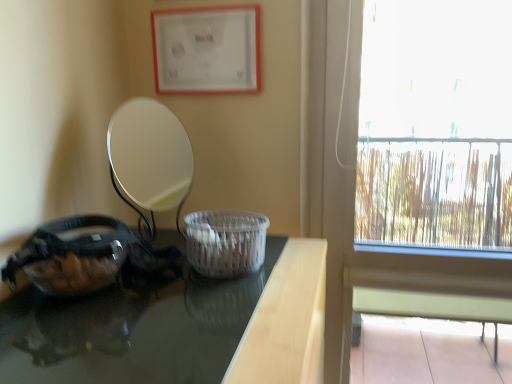
I want to click on transparent glass bowl at left, so click(72, 256).

You are a GUI agent. You are given a task and a screenshot of the screen. Output one action in this format:
    pyautogui.click(x=<x>, y=<y>)
    Task: Click on the white woven basket at center
    This screenshot has width=512, height=384.
    Given the screenshot: What is the action you would take?
    pyautogui.click(x=225, y=242)

Describe the element at coordinates (177, 328) in the screenshot. The height and width of the screenshot is (384, 512). I see `black glossy table at left` at that location.

Image resolution: width=512 pixels, height=384 pixels. Describe the element at coordinates (207, 50) in the screenshot. I see `matte white picture frame at upper center` at that location.

Find the location of a particular element. The height and width of the screenshot is (384, 512). matte white picture frame at upper center is located at coordinates (207, 50).

At what (x,y) coordinates should I click in order to perform the action: click on transparent glass bowl at left. Please return your answer as a coordinate pair (x, y). The height and width of the screenshot is (384, 512). Looking at the image, I should click on (72, 256).

Is transparent glass bowl at left in contact with black glossy table at left?

No, transparent glass bowl at left is not beside black glossy table at left.

Is point (36, 275) positioned after point (81, 334)?

Yes.

Is black glossy table at left a part of transparent glass bowl at left?

That's incorrect, black glossy table at left is not inside transparent glass bowl at left.

Considering the relative positions of transparent glass bowl at left and black glossy table at left in the image provided, is transparent glass bowl at left in front of black glossy table at left?

No, transparent glass bowl at left is further to the viewer.

Is white woven basket at center positioned with its back to transparent glass window at right?

No, white woven basket at center is not facing the opposite direction of transparent glass window at right.

From the picture: How many degrees apart are the facing directions of white woven basket at center and transparent glass window at right?

They differ by 93 degrees in their facing directions.

Looking at this image, is white woven basket at center at the right side of transparent glass window at right?

No.

Is white woven basket at center far away from transparent glass window at right?

Yes, white woven basket at center is far from transparent glass window at right.

Is matte white picture frame at upper center located within white woven basket at center?

That's incorrect, matte white picture frame at upper center is not inside white woven basket at center.

Is the surface of white woven basket at center in direct contact with matte white picture frame at upper center?

white woven basket at center is not next to matte white picture frame at upper center, and they're not touching.

Considering the sizes of white woven basket at center and matte white picture frame at upper center in the image, is white woven basket at center bigger or smaller than matte white picture frame at upper center?

Clearly, white woven basket at center is larger in size than matte white picture frame at upper center.

Is black glossy table at left closer to camera compared to transparent glass window at right?

Yes, it is in front of transparent glass window at right.

Is black glossy table at left oriented towards transparent glass window at right?

No, black glossy table at left is not turned towards transparent glass window at right.

Based on the photo, between black glossy table at left and transparent glass window at right, which one has larger width?

With larger width is black glossy table at left.

Who is smaller, transparent glass bowl at left or white woven basket at center?

Smaller between the two is white woven basket at center.

From the image's perspective, is transparent glass bowl at left located above or below white woven basket at center?

Based on their image positions, transparent glass bowl at left is located beneath white woven basket at center.

Is transparent glass bowl at left further to the viewer compared to white woven basket at center?

No, the depth of transparent glass bowl at left is less than that of white woven basket at center.

Is transparent glass bowl at left bigger than transparent glass window at right?

Actually, transparent glass bowl at left might be smaller than transparent glass window at right.

Can you tell me how much transparent glass bowl at left and transparent glass window at right differ in facing direction?

The facing directions of transparent glass bowl at left and transparent glass window at right are 91.8 degrees apart.

From a real-world perspective, is transparent glass bowl at left positioned under transparent glass window at right based on gravity?

Incorrect, from a real-world perspective, transparent glass bowl at left is higher than transparent glass window at right.

Does transparent glass bowl at left come behind transparent glass window at right?

That is False.

Choose the correct answer: Is black glossy table at left inside matte white picture frame at upper center or outside it?

black glossy table at left is located beyond the bounds of matte white picture frame at upper center.

Between black glossy table at left and matte white picture frame at upper center, which one has less height?

Standing shorter between the two is matte white picture frame at upper center.

Considering the sizes of objects black glossy table at left and matte white picture frame at upper center in the image provided, who is smaller, black glossy table at left or matte white picture frame at upper center?

matte white picture frame at upper center.

From the image's perspective, is black glossy table at left located above matte white picture frame at upper center?

No.

Where is `glass bowl on the left of the black glossy table at left`? This screenshot has height=384, width=512. glass bowl on the left of the black glossy table at left is located at coordinates (72, 256).

Image resolution: width=512 pixels, height=384 pixels. What are the coordinates of `basket container in front of the transparent glass window at right` in the screenshot? It's located at (225, 242).

When comparing their distances from transparent glass window at right, does transparent glass bowl at left or black glossy table at left seem closer?

black glossy table at left.

When comparing their distances from transparent glass window at right, does black glossy table at left or white woven basket at center seem closer?

Among the two, white woven basket at center is located nearer to transparent glass window at right.

Estimate the real-world distances between objects in this image. Which object is closer to black glossy table at left, transparent glass bowl at left or matte white picture frame at upper center?

Among the two, transparent glass bowl at left is located nearer to black glossy table at left.

Considering their positions, is transparent glass bowl at left positioned closer to black glossy table at left than white woven basket at center?

white woven basket at center lies closer to black glossy table at left than the other object.

From the image, which object appears to be farther from transparent glass bowl at left, matte white picture frame at upper center or black glossy table at left?

matte white picture frame at upper center is positioned further to the anchor transparent glass bowl at left.

Looking at the image, which one is located closer to matte white picture frame at upper center, transparent glass bowl at left or black glossy table at left?

transparent glass bowl at left is positioned closer to the anchor matte white picture frame at upper center.

Looking at this image, which object lies nearer to the anchor point transparent glass window at right, white woven basket at center or black glossy table at left?

Among the two, white woven basket at center is located nearer to transparent glass window at right.

Based on the photo, from the image, which object appears to be nearer to black glossy table at left, matte white picture frame at upper center or transparent glass bowl at left?

transparent glass bowl at left is closer to black glossy table at left.

Where is `window that lies between matte white picture frame at upper center and black glossy table at left from top to bottom`? Image resolution: width=512 pixels, height=384 pixels. window that lies between matte white picture frame at upper center and black glossy table at left from top to bottom is located at coordinates (436, 124).

Identify the location of basket container between matte white picture frame at upper center and black glossy table at left in the up-down direction. This screenshot has height=384, width=512. (225, 242).

Identify the location of basket container located between black glossy table at left and transparent glass window at right in the left-right direction. (225, 242).

At what (x,y) coordinates should I click in order to perform the action: click on table between transparent glass bowl at left and transparent glass window at right in the horizontal direction. Please return your answer as a coordinate pair (x, y). Looking at the image, I should click on (177, 328).